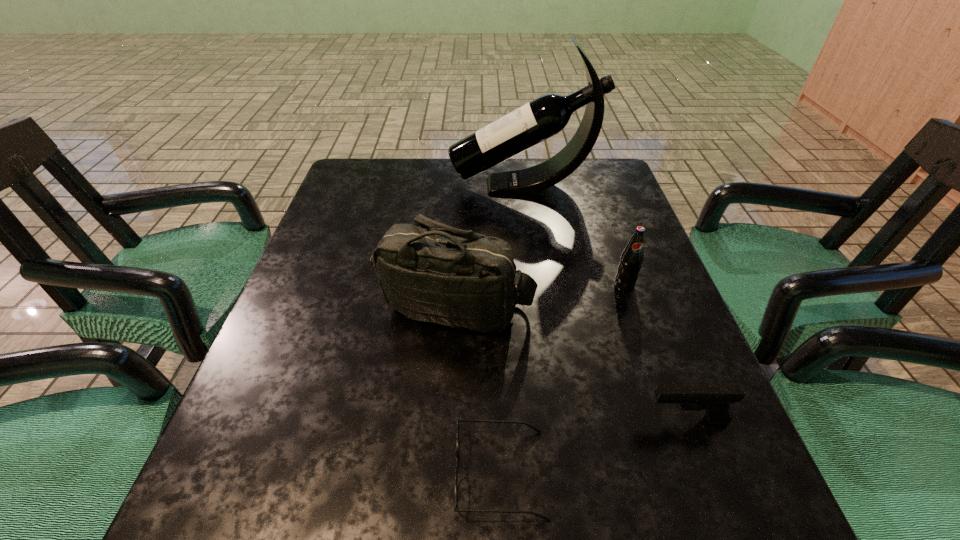
The image size is (960, 540). Identify the location of free region that satisfies the following two spatial constraints: 1. on the stand of the farthest object; 2. at the front padded panel of the shoulder bag. (540, 307).